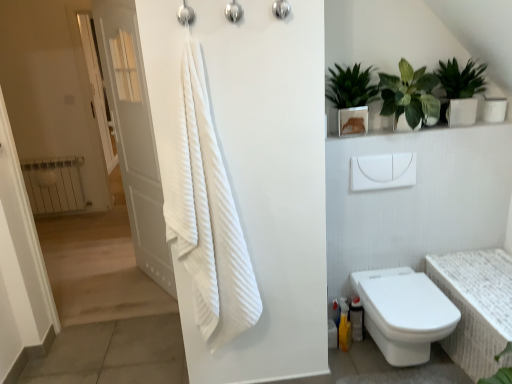
Find the location of `free space above white glossy toilet at lower right (from a real-world perspective)`. free space above white glossy toilet at lower right (from a real-world perspective) is located at coordinates (404, 291).